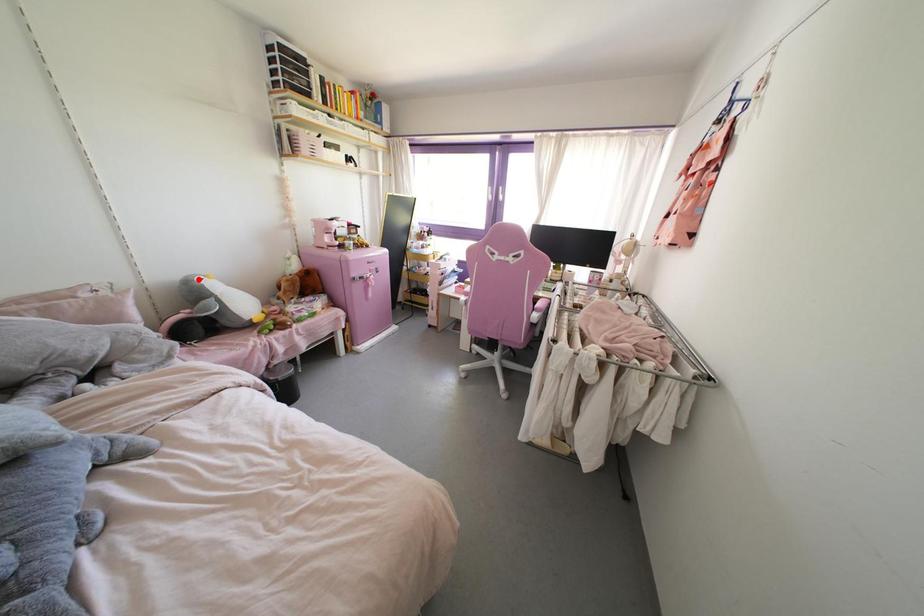
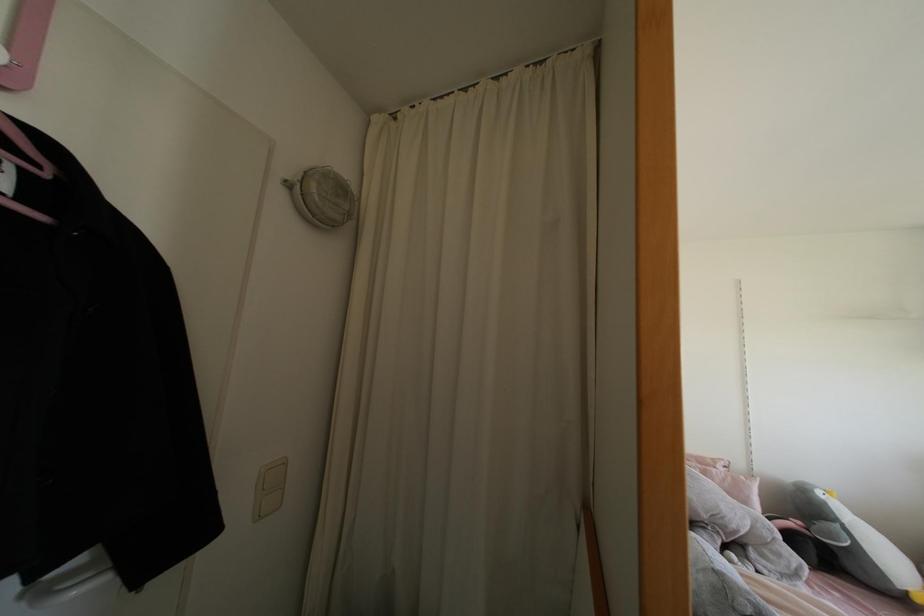
Where in the second image is the point corresponding to the highlighted location from the first image?

(819, 493)